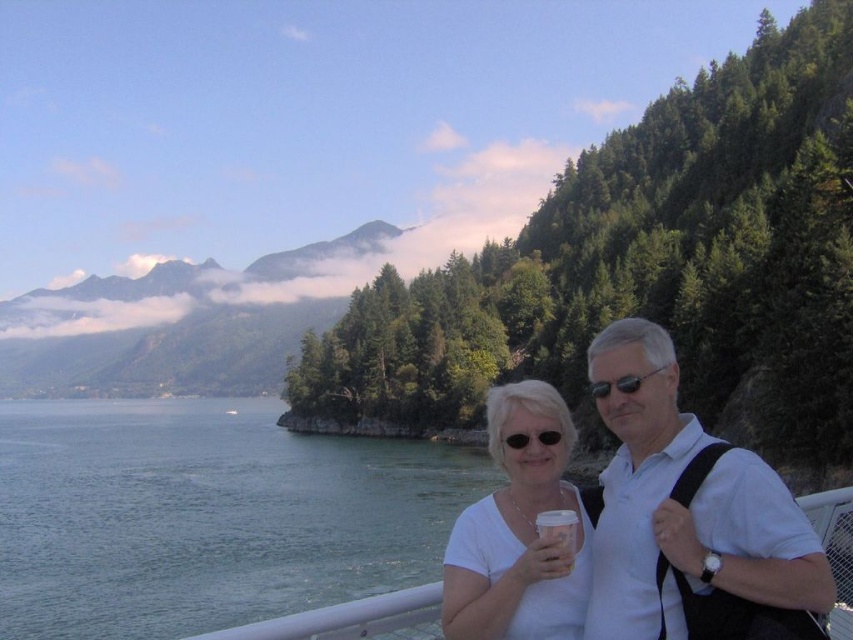
Consider the image. Which is above, blue water at lower left or white paper cup at center?

white paper cup at center is higher up.

Which is below, blue water at lower left or white paper cup at center?

Positioned lower is blue water at lower left.

At what (x,y) coordinates should I click in order to perform the action: click on blue water at lower left. Please return your answer as a coordinate pair (x, y). The height and width of the screenshot is (640, 853). Looking at the image, I should click on (207, 516).

Does white matte shirt at right have a lesser height compared to white paper cup at center?

Incorrect, white matte shirt at right's height does not fall short of white paper cup at center's.

Describe the element at coordinates (683, 508) in the screenshot. This screenshot has height=640, width=853. I see `white matte shirt at right` at that location.

Does point (759, 484) come closer to viewer compared to point (552, 513)?

Yes.

Where is `white matte shirt at right`? This screenshot has width=853, height=640. white matte shirt at right is located at coordinates (683, 508).

From the picture: Who is positioned more to the right, white matte shirt at right or black reflective sunglasses at upper right?

black reflective sunglasses at upper right

Is point (630, 516) in front of point (628, 394)?

Yes, point (630, 516) is closer to viewer.

Locate an element on the screen. The image size is (853, 640). white matte shirt at right is located at coordinates tap(683, 508).

At what (x,y) coordinates should I click in order to perform the action: click on white matte shirt at right. Please return your answer as a coordinate pair (x, y). Looking at the image, I should click on (683, 508).